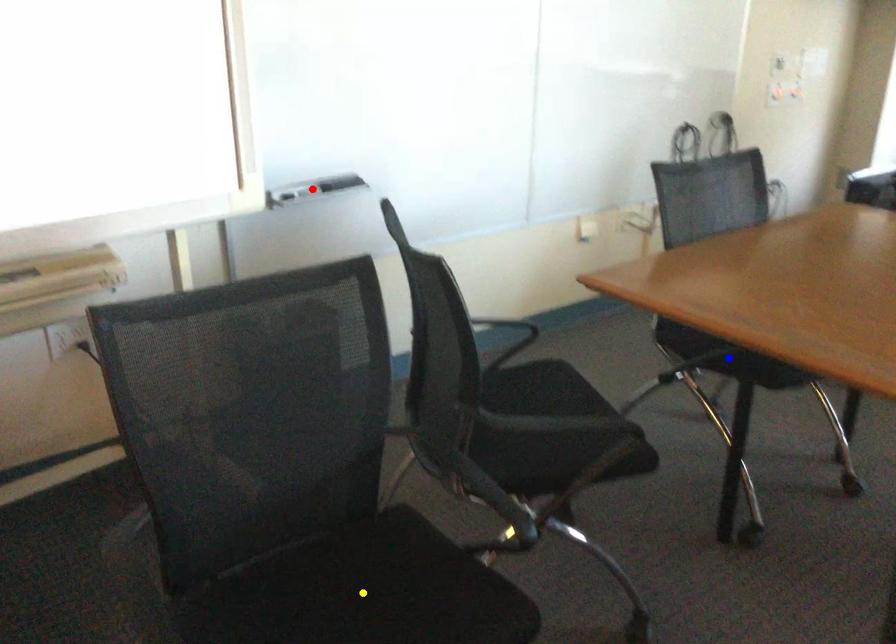
Order these from farthest to nearest:
yellow point | blue point | red point

red point → blue point → yellow point